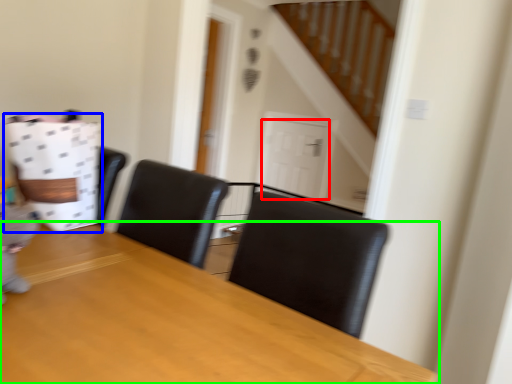
Question: Considering the real-world distances, which object is farthest from door (highlighted by a red box)? paper bag (highlighted by a blue box) or table (highlighted by a green box)?

Choices:
 (A) paper bag
 (B) table

Answer: (B)